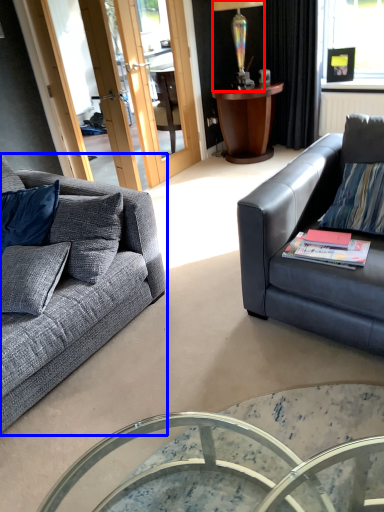
Question: Which point is further to the camera, lamp (highlighted by a red box) or studio couch (highlighted by a blue box)?

Choices:
 (A) lamp
 (B) studio couch

Answer: (A)